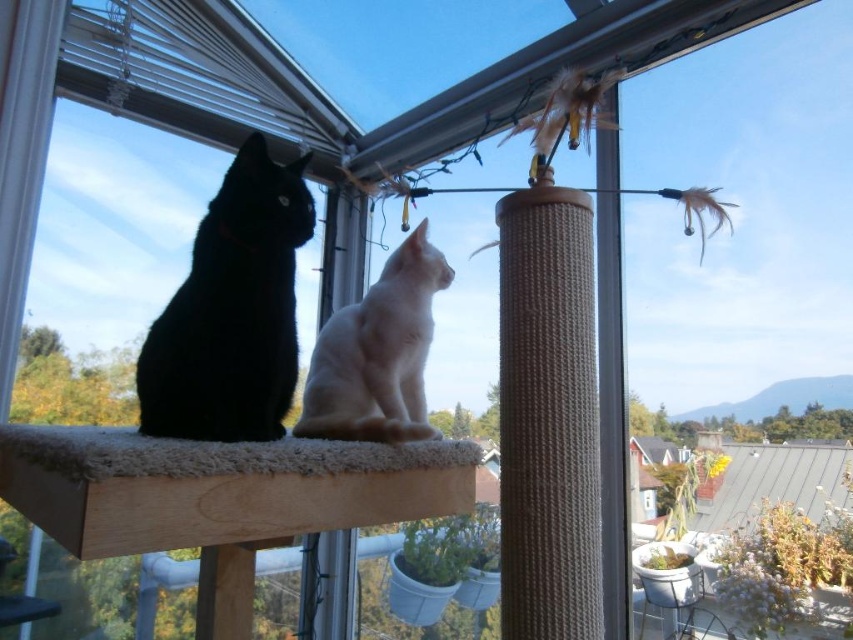
You are a cat owner who wants to ensure your cats can reach the braided rope scratching post at center and the white fur cat at center. Based on their heights, which one is taller?

The braided rope scratching post at center is taller than the white fur cat at center.

You are a cat owner who wants to place a small toy between the black matte cat at left and the white fur cat at center. The toy requires 10 inches of space to be placed safely. Can the toy be placed between them?

The black matte cat at left is 8.41 inches from white fur cat at center, so the toy cannot be placed between them since the required space is 10 inches which is more than the available distance.